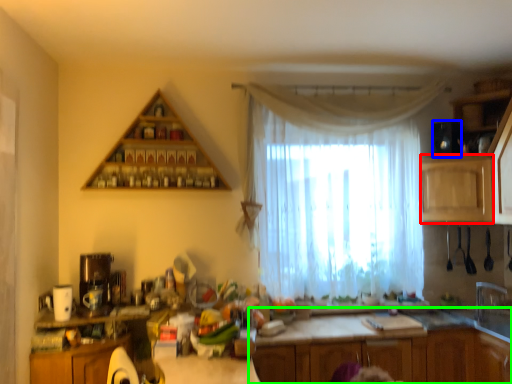
Question: Based on their relative distances, which object is nearer to cabinetry (highlighted by a red box)? Choose from appliance (highlighted by a blue box) and cabinetry (highlighted by a green box).

Choices:
 (A) appliance
 (B) cabinetry

Answer: (A)